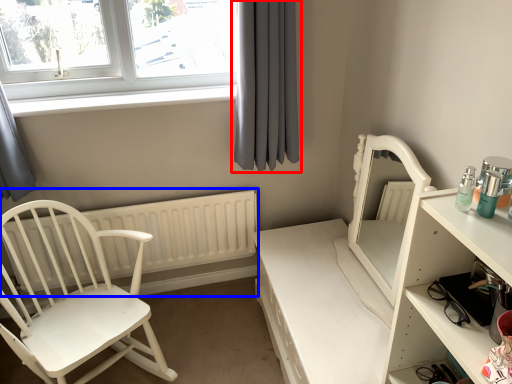
Question: Which point is closer to the camera, curtain (highlighted by a red box) or radiator (highlighted by a blue box)?

Choices:
 (A) curtain
 (B) radiator

Answer: (A)